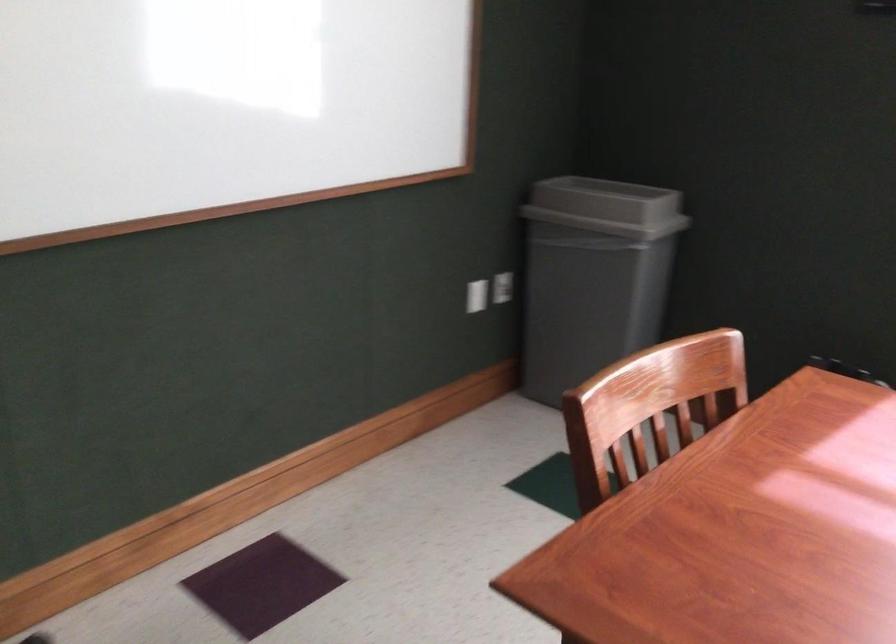
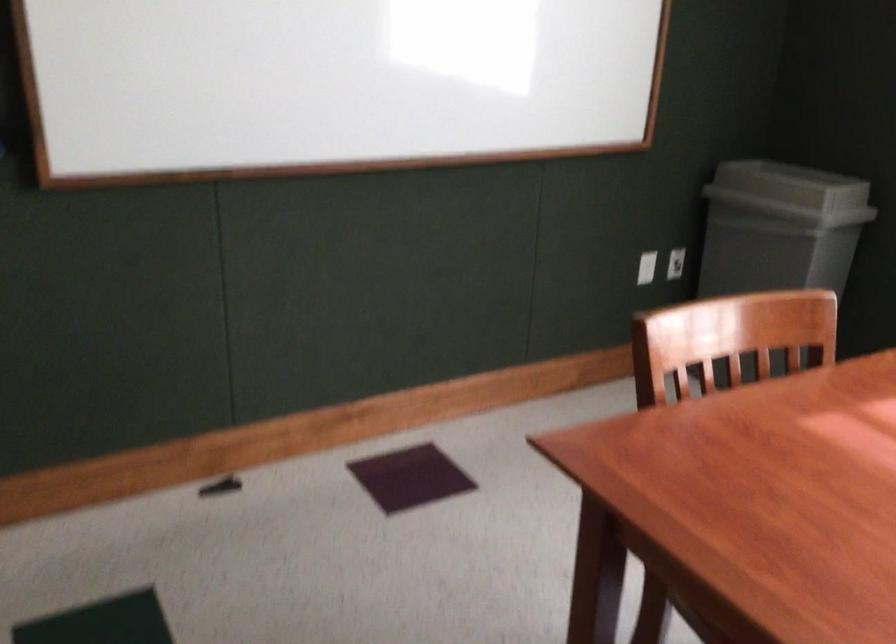
In the second image, find the point that corresponds to (x=609, y=205) in the first image.

(791, 185)